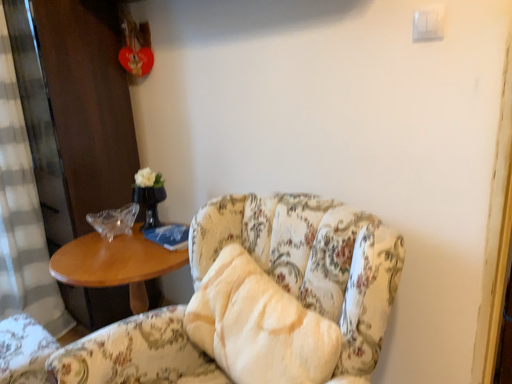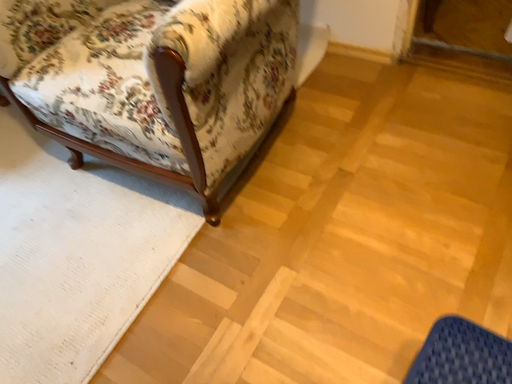
Question: How did the camera likely rotate when shooting the video?

Choices:
 (A) rotated left
 (B) rotated right

Answer: (B)